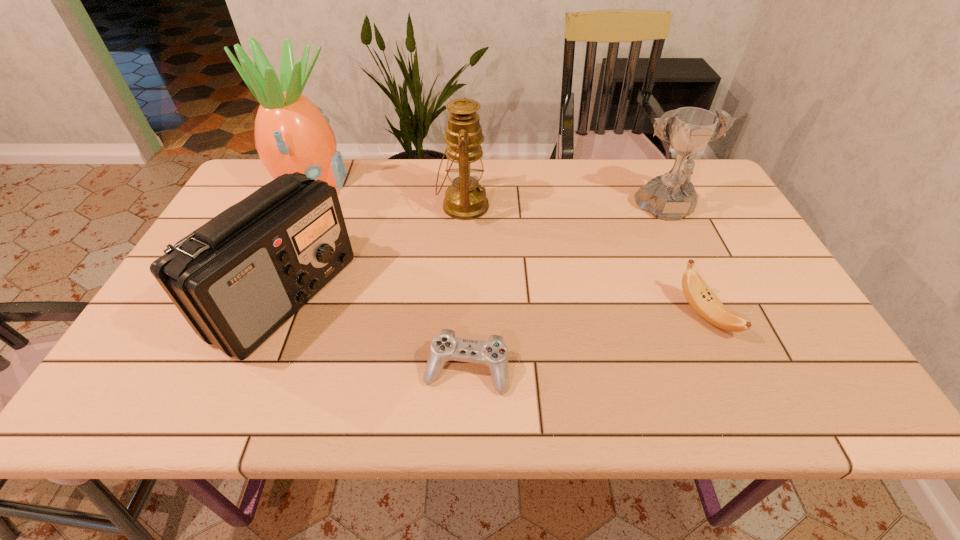
What are the coordinates of `free location located 0.340m on the back of the banana` in the screenshot? It's located at (655, 205).

At what (x,y) coordinates should I click in order to perform the action: click on vacant space located 0.070m on the back of the control. Please return your answer as a coordinate pair (x, y). The image size is (960, 540). Looking at the image, I should click on (468, 319).

In order to click on pineapple that is at the far edge in this screenshot , I will do `click(292, 134)`.

At what (x,y) coordinates should I click in order to perform the action: click on oil lamp present at the far edge. Please return your answer as a coordinate pair (x, y). The height and width of the screenshot is (540, 960). Looking at the image, I should click on (465, 199).

You are a GUI agent. You are given a task and a screenshot of the screen. Output one action in this format:
    pyautogui.click(x=<x>, y=<y>)
    Task: Click on the award located in the far edge section of the desktop
    
    Given the screenshot: What is the action you would take?
    pyautogui.click(x=670, y=197)

Where is `object present at the near edge`? The height and width of the screenshot is (540, 960). object present at the near edge is located at coordinates (445, 346).

Where is `pineapple that is at the left edge`? This screenshot has width=960, height=540. pineapple that is at the left edge is located at coordinates (292, 134).

Locate an element on the screen. This screenshot has height=540, width=960. radio receiver that is positioned at the left edge is located at coordinates (238, 278).

The width and height of the screenshot is (960, 540). Find the location of `object that is at the right edge`. object that is at the right edge is located at coordinates (670, 197).

Image resolution: width=960 pixels, height=540 pixels. I want to click on object at the far left corner, so tap(292, 134).